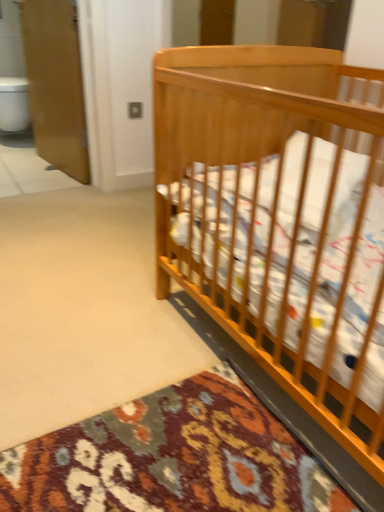
Question: Is white glossy toilet bowl at left aimed at white tile at left?

Choices:
 (A) yes
 (B) no

Answer: (A)

Question: Can you confirm if white glossy toilet bowl at left is smaller than white tile at left?

Choices:
 (A) yes
 (B) no

Answer: (B)

Question: Is white glossy toilet bowl at left to the right of white tile at left from the viewer's perspective?

Choices:
 (A) no
 (B) yes

Answer: (A)

Question: Can you confirm if white glossy toilet bowl at left is thinner than white tile at left?

Choices:
 (A) yes
 (B) no

Answer: (A)

Question: Does white glossy toilet bowl at left touch white tile at left?

Choices:
 (A) yes
 (B) no

Answer: (B)

Question: In the image, is wooden screen door at upper left on the left side or the right side of light brown wood crib at right?

Choices:
 (A) right
 (B) left

Answer: (B)

Question: Is wooden screen door at upper left inside or outside of light brown wood crib at right?

Choices:
 (A) inside
 (B) outside

Answer: (B)

Question: Considering the positions of wooden screen door at upper left and light brown wood crib at right in the image, is wooden screen door at upper left wider or thinner than light brown wood crib at right?

Choices:
 (A) thin
 (B) wide

Answer: (A)

Question: Considering the positions of wooden screen door at upper left and light brown wood crib at right in the image, is wooden screen door at upper left bigger or smaller than light brown wood crib at right?

Choices:
 (A) big
 (B) small

Answer: (B)

Question: In terms of width, does white tile at left look wider or thinner when compared to wooden screen door at upper left?

Choices:
 (A) wide
 (B) thin

Answer: (A)

Question: Is white tile at left taller or shorter than wooden screen door at upper left?

Choices:
 (A) short
 (B) tall

Answer: (A)

Question: Is white tile at left inside or outside of wooden screen door at upper left?

Choices:
 (A) outside
 (B) inside

Answer: (A)

Question: Is white tile at left bigger or smaller than wooden screen door at upper left?

Choices:
 (A) small
 (B) big

Answer: (A)

Question: In terms of width, does white glossy toilet bowl at left look wider or thinner when compared to light brown wood crib at right?

Choices:
 (A) thin
 (B) wide

Answer: (A)

Question: Is white glossy toilet bowl at left inside the boundaries of light brown wood crib at right, or outside?

Choices:
 (A) outside
 (B) inside

Answer: (A)